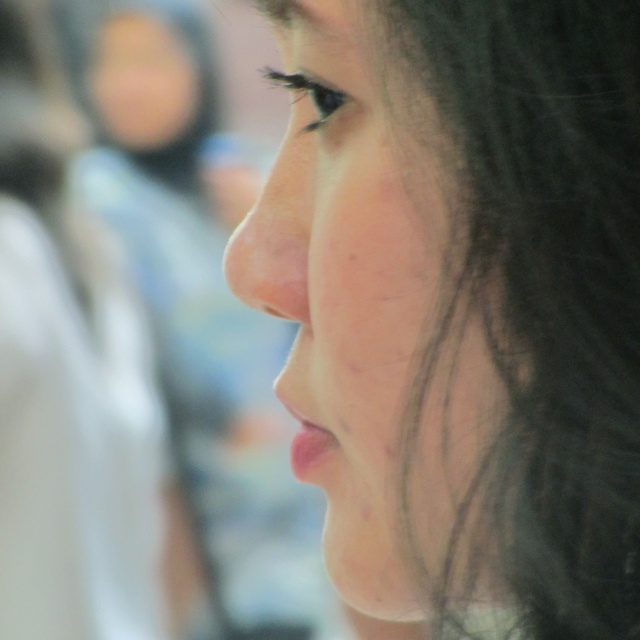
Is the position of smooth skin nose at center less distant than that of shiny black eye at upper center?

No, it is not.

Does smooth skin nose at center lie behind shiny black eye at upper center?

Yes, smooth skin nose at center is behind shiny black eye at upper center.

The image size is (640, 640). Describe the element at coordinates (275, 240) in the screenshot. I see `smooth skin nose at center` at that location.

Locate an element on the screen. This screenshot has height=640, width=640. smooth skin nose at center is located at coordinates (275, 240).

Which is more to the left, smooth skin face at center or smooth skin nose at center?

smooth skin nose at center

Does point (317, 344) lie behind point (257, 260)?

No, it is in front of (257, 260).

Is point (392, 481) positioned behind point (282, 252)?

No, (392, 481) is closer to viewer.

This screenshot has width=640, height=640. I want to click on smooth skin face at center, so click(372, 314).

Between smooth skin face at center and shiny black eye at upper center, which one is positioned higher?

shiny black eye at upper center is above.

Describe the element at coordinates (372, 314) in the screenshot. I see `smooth skin face at center` at that location.

Which is in front, point (483, 394) or point (292, 83)?

Point (483, 394)

The height and width of the screenshot is (640, 640). Identify the location of smooth skin face at center. (372, 314).